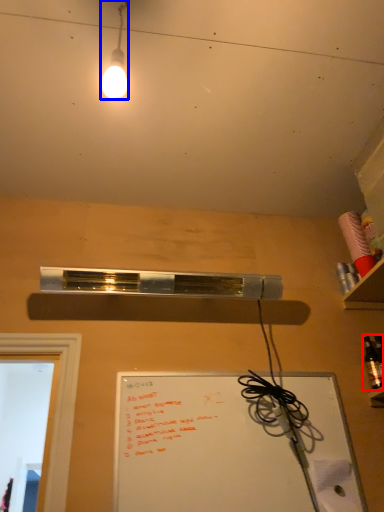
Question: Which of the following is the closest to the observer, bottle (highlighted by a red box) or lamp (highlighted by a blue box)?

Choices:
 (A) bottle
 (B) lamp

Answer: (B)